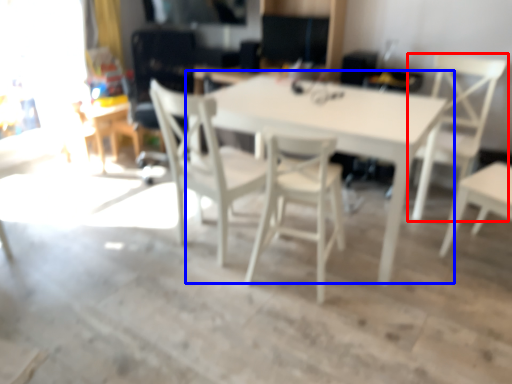
Question: Which point is further to the camera, chair (highlighted by a red box) or table (highlighted by a blue box)?

Choices:
 (A) chair
 (B) table

Answer: (A)